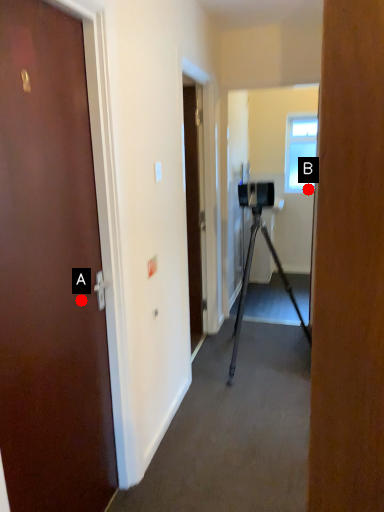
Question: Two points are circled on the image, labeled by A and B beside each circle. Which point is closer to the camera taking this photo?

Choices:
 (A) A is closer
 (B) B is closer

Answer: (A)